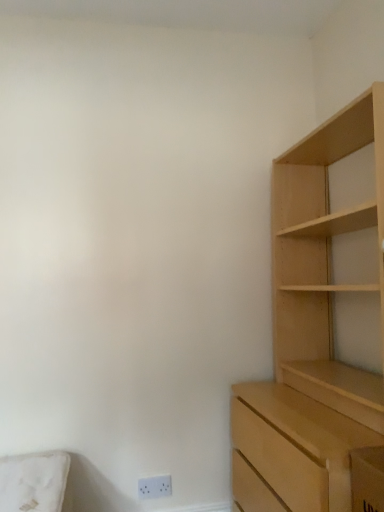
Question: Relative to light wood cupboard at right, is white plastic electric outlet at lower center in front or behind?

Choices:
 (A) front
 (B) behind

Answer: (B)

Question: Looking at the image, does white plastic electric outlet at lower center seem bigger or smaller compared to light wood cupboard at right?

Choices:
 (A) big
 (B) small

Answer: (B)

Question: Based on their positions, is white plastic electric outlet at lower center located to the left or right of light wood cupboard at right?

Choices:
 (A) right
 (B) left

Answer: (B)

Question: Considering the positions of light wood cupboard at right and white plastic electric outlet at lower center in the image, is light wood cupboard at right wider or thinner than white plastic electric outlet at lower center?

Choices:
 (A) wide
 (B) thin

Answer: (A)

Question: Is light wood cupboard at right spatially inside white plastic electric outlet at lower center, or outside of it?

Choices:
 (A) outside
 (B) inside

Answer: (A)

Question: From a real-world perspective, is light wood cupboard at right physically located above or below white plastic electric outlet at lower center?

Choices:
 (A) above
 (B) below

Answer: (A)

Question: Is point (304, 388) positioned closer to the camera than point (170, 490)?

Choices:
 (A) closer
 (B) farther

Answer: (A)